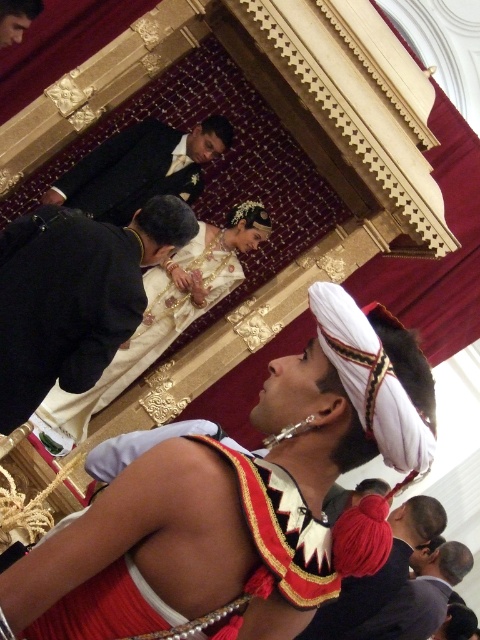
Question: Which of these objects is positioned farthest from the dark suit at center?

Choices:
 (A) red velvet robe at lower center
 (B) black velvet suit at upper left
 (C) red velvet turban at center

Answer: (C)

Question: Which is nearer to the red velvet turban at center?

Choices:
 (A) black velvet suit at upper left
 (B) dark suit at center
 (C) white satin dress at center

Answer: (C)

Question: Does white satin dress at center have a lesser width compared to dark suit at center?

Choices:
 (A) no
 (B) yes

Answer: (A)

Question: Is red velvet robe at lower center wider than dark suit at center?

Choices:
 (A) no
 (B) yes

Answer: (A)

Question: Which is farther from the black velvet suit at upper left?

Choices:
 (A) white satin dress at center
 (B) red velvet turban at center
 (C) dark gray suit at lower right

Answer: (C)

Question: Does black velvet suit at upper left have a greater width compared to red velvet turban at center?

Choices:
 (A) no
 (B) yes

Answer: (A)